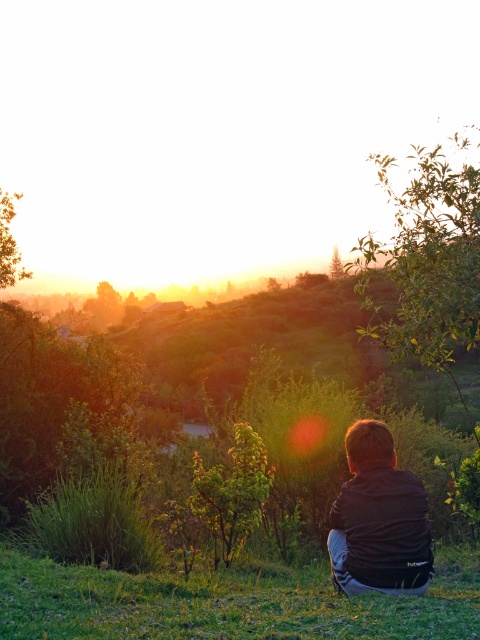
Does green grassy at lower center have a smaller size compared to black matte jacket at center?

No.

Is green grassy at lower center wider than black matte jacket at center?

Correct, the width of green grassy at lower center exceeds that of black matte jacket at center.

Image resolution: width=480 pixels, height=640 pixels. Describe the element at coordinates (228, 602) in the screenshot. I see `green grassy at lower center` at that location.

Find the location of a particular element. The height and width of the screenshot is (640, 480). green grassy at lower center is located at coordinates (228, 602).